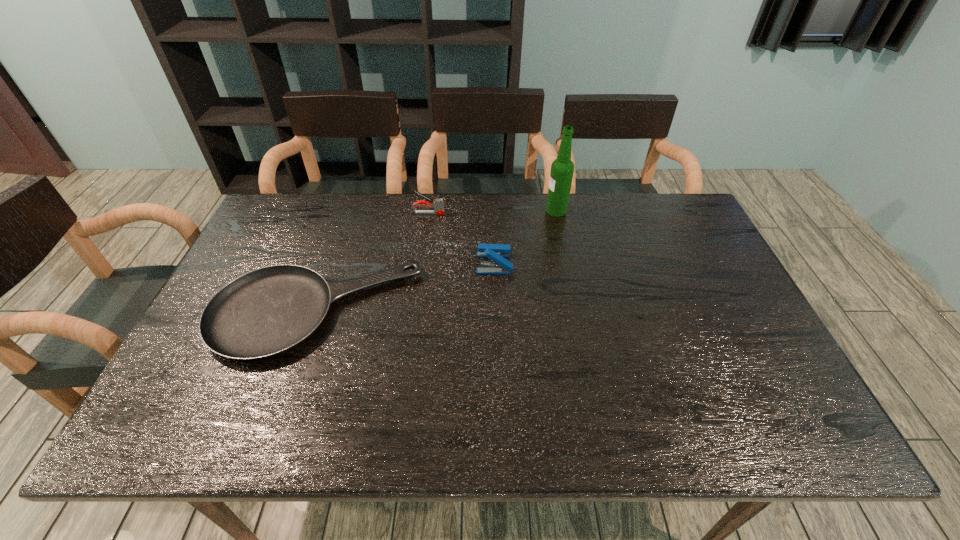
Find the location of a particular element. This screenshot has height=540, width=960. beer bottle is located at coordinates (562, 169).

Find the location of a particular element. the tallest object is located at coordinates (562, 169).

You are a GUI agent. You are given a task and a screenshot of the screen. Output one action in this format:
    pyautogui.click(x=<x>, y=<y>)
    Task: Click on the left stapler
    The image size is (960, 540).
    Given the screenshot: What is the action you would take?
    pyautogui.click(x=438, y=205)

Locate an element on the screen. The height and width of the screenshot is (540, 960). the second object from right to left is located at coordinates (496, 252).

The image size is (960, 540). What are the coordinates of `the nearer stapler` in the screenshot? It's located at (496, 252).

Find the location of a particular element. frying pan is located at coordinates (265, 312).

Locate an element on the screen. free space located 0.340m on the label of the rightmost object is located at coordinates (444, 210).

What are the coordinates of `blank space located on the label of the rightmost object` in the screenshot? It's located at [426, 210].

Where is `free space located 0.110m on the label of the rightmost object`? The width and height of the screenshot is (960, 540). free space located 0.110m on the label of the rightmost object is located at coordinates (513, 210).

Image resolution: width=960 pixels, height=540 pixels. Identify the location of vacant point located on the handle side of the farther stapler. (550, 213).